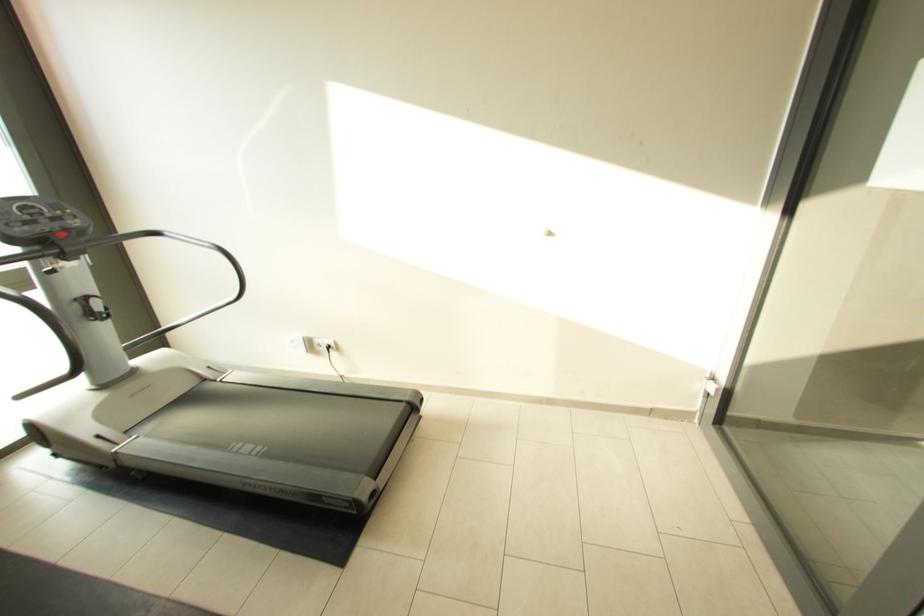
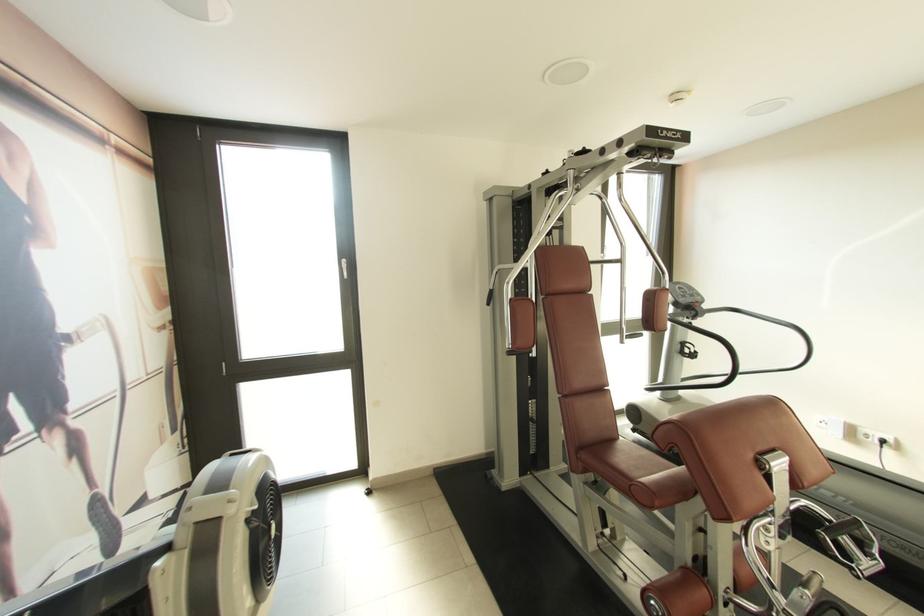
Locate, in the second image, the point that corresponds to point (331, 350) in the first image.

(882, 445)